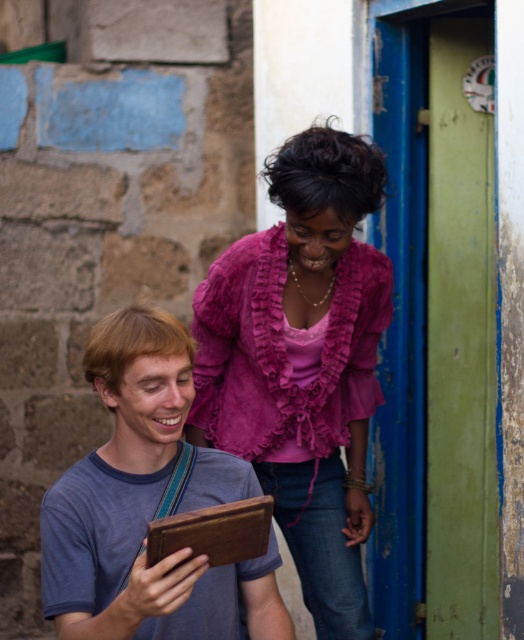
You are a photographer trying to capture a candid shot of both the pink ruffled blouse at center and the matte brown tablet at lower left. Based on their positions, which object should you focus on first to ensure both are in frame?

The pink ruffled blouse at center is positioned on the right side of the matte brown tablet at lower left, so focusing on the matte brown tablet at lower left first will allow you to include both objects in the frame since the tablet is closer to the left edge.

You are a fashion designer observing the image. You need to decide whether the pink ruffled blouse at center can fit into a display case that is the same width as the matte brown tablet at lower left. Can it fit?

The pink ruffled blouse at center might be wider than matte brown tablet at lower left, so it may not fit into the display case designed for the tablet.